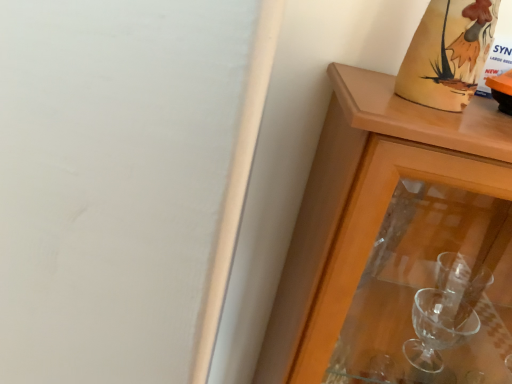
In order to face wooden cabinet at upper right, should I rotate leftwards or rightwards?

It's best to rotate right around 24.679 degrees.

Describe the element at coordinates (396, 243) in the screenshot. I see `wooden cabinet at upper right` at that location.

Locate an element on the screen. wooden cabinet at upper right is located at coordinates (396, 243).

Measure the distance between wooden cabinet at upper right and camera.

17.62 inches.

Locate an element on the screen. The height and width of the screenshot is (384, 512). wooden cabinet at upper right is located at coordinates (396, 243).